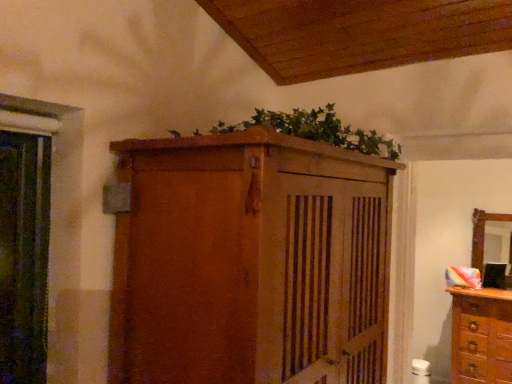
Question: From a real-world perspective, does matte wooden cupboard at upper center sit lower than green leafy plant at upper center?

Choices:
 (A) yes
 (B) no

Answer: (A)

Question: Can you confirm if matte wooden cupboard at upper center is smaller than green leafy plant at upper center?

Choices:
 (A) yes
 (B) no

Answer: (B)

Question: From the image's perspective, is matte wooden cupboard at upper center over green leafy plant at upper center?

Choices:
 (A) no
 (B) yes

Answer: (A)

Question: Is green leafy plant at upper center a part of matte wooden cupboard at upper center?

Choices:
 (A) no
 (B) yes

Answer: (A)

Question: Is matte wooden cupboard at upper center positioned before green leafy plant at upper center?

Choices:
 (A) yes
 (B) no

Answer: (A)

Question: Visually, is green leafy plant at upper center positioned to the left or to the right of wooden dresser at right?

Choices:
 (A) right
 (B) left

Answer: (B)

Question: From a real-world perspective, is green leafy plant at upper center physically located above or below wooden dresser at right?

Choices:
 (A) below
 (B) above

Answer: (B)

Question: Based on their sizes in the image, would you say green leafy plant at upper center is bigger or smaller than wooden dresser at right?

Choices:
 (A) small
 (B) big

Answer: (A)

Question: Considering the positions of green leafy plant at upper center and wooden dresser at right in the image, is green leafy plant at upper center wider or thinner than wooden dresser at right?

Choices:
 (A) wide
 (B) thin

Answer: (A)

Question: Is wooden dresser at right taller or shorter than matte wooden cupboard at upper center?

Choices:
 (A) short
 (B) tall

Answer: (A)

Question: In terms of width, does wooden dresser at right look wider or thinner when compared to matte wooden cupboard at upper center?

Choices:
 (A) wide
 (B) thin

Answer: (B)

Question: From a real-world perspective, is wooden dresser at right physically located above or below matte wooden cupboard at upper center?

Choices:
 (A) above
 (B) below

Answer: (B)

Question: Visually, is wooden dresser at right positioned to the left or to the right of matte wooden cupboard at upper center?

Choices:
 (A) left
 (B) right

Answer: (B)

Question: From a real-world perspective, is wooden mirror at right above or below matte wooden cupboard at upper center?

Choices:
 (A) above
 (B) below

Answer: (A)

Question: In terms of height, does wooden mirror at right look taller or shorter compared to matte wooden cupboard at upper center?

Choices:
 (A) tall
 (B) short

Answer: (B)